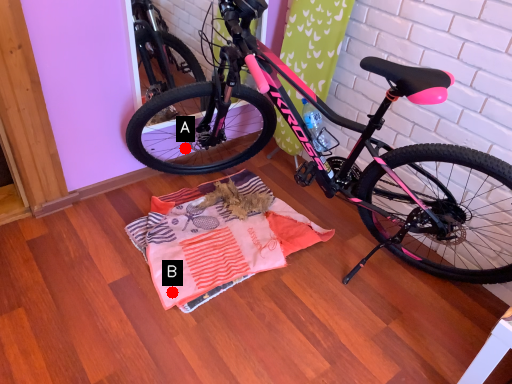
Question: Two points are circled on the image, labeled by A and B beside each circle. Which point appears closest to the camera in this image?

Choices:
 (A) A is closer
 (B) B is closer

Answer: (B)